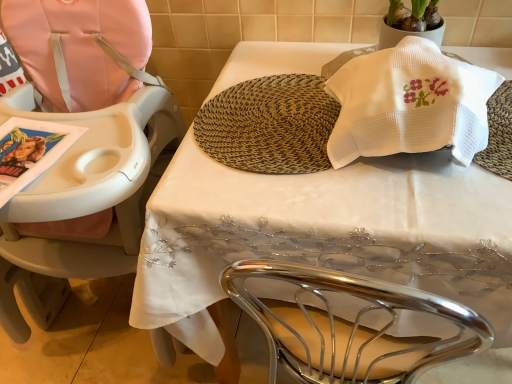
The width and height of the screenshot is (512, 384). Identify the location of white waffle-textured towel at upper right. (409, 104).

What do you see at coordinates (323, 234) in the screenshot?
I see `white embroidered tablecloth at center` at bounding box center [323, 234].

This screenshot has height=384, width=512. What do you see at coordinates (269, 125) in the screenshot? I see `brown woven mat at center` at bounding box center [269, 125].

Find the location of `white waffle-textured towel at upper right`. white waffle-textured towel at upper right is located at coordinates 409,104.

Is white waffle-textured towel at upper right smaller than brown woven mat at center?

No.

From the image's perspective, is white waffle-textured towel at upper right positioned above or below brown woven mat at center?

white waffle-textured towel at upper right is above brown woven mat at center.

Is white waffle-textured towel at upper right far away from brown woven mat at center?

Actually, white waffle-textured towel at upper right and brown woven mat at center are a little close together.

Does point (486, 143) come farther from viewer compared to point (224, 155)?

No, (486, 143) is closer to viewer.

In order to click on table located underneath the pink fabric highchair at left (from a real-world perspective) in this screenshot , I will do `click(323, 234)`.

Is pink fabric highchair at left not inside white embroidered tablecloth at center?

Absolutely, pink fabric highchair at left is external to white embroidered tablecloth at center.

Is pink fabric highchair at left far away from white embroidered tablecloth at center?

No, pink fabric highchair at left is in close proximity to white embroidered tablecloth at center.

Which of these two, pink fabric highchair at left or white embroidered tablecloth at center, is smaller?

pink fabric highchair at left is smaller.

Is point (396, 241) closer to viewer compared to point (399, 122)?

That is True.

What's the angular difference between white embroidered tablecloth at center and white waffle-textured towel at upper right's facing directions?

0.92 degrees.

Considering the relative sizes of white embroidered tablecloth at center and white waffle-textured towel at upper right in the image provided, is white embroidered tablecloth at center thinner than white waffle-textured towel at upper right?

No, white embroidered tablecloth at center is not thinner than white waffle-textured towel at upper right.

Based on their positions, is white embroidered tablecloth at center located to the left or right of white waffle-textured towel at upper right?

In the image, white embroidered tablecloth at center appears on the right side of white waffle-textured towel at upper right.

How many degrees apart are the facing directions of brown woven mat at center and white waffle-textured towel at upper right?

0.184 degrees separate the facing orientations of brown woven mat at center and white waffle-textured towel at upper right.

Locate an element on the screen. Image resolution: width=512 pixels, height=384 pixels. mat below the white waffle-textured towel at upper right (from the image's perspective) is located at coordinates (269, 125).

From a real-world perspective, who is located higher, brown woven mat at center or white waffle-textured towel at upper right?

white waffle-textured towel at upper right, from a real-world perspective.

Is brown woven mat at center oriented towards white waffle-textured towel at upper right?

No, brown woven mat at center is not turned towards white waffle-textured towel at upper right.

The width and height of the screenshot is (512, 384). Find the location of `chair to the left of brown woven mat at center`. chair to the left of brown woven mat at center is located at coordinates (83, 148).

Considering the sizes of objects brown woven mat at center and pink fabric highchair at left in the image provided, who is bigger, brown woven mat at center or pink fabric highchair at left?

pink fabric highchair at left.

How far apart are brown woven mat at center and pink fabric highchair at left?

13.14 inches.

Between brown woven mat at center and pink fabric highchair at left, which one has larger width?

pink fabric highchair at left is wider.

Who is shorter, brown woven mat at center or white embroidered tablecloth at center?

brown woven mat at center.

Does brown woven mat at center touch white embroidered tablecloth at center?

No, brown woven mat at center is not with white embroidered tablecloth at center.

Image resolution: width=512 pixels, height=384 pixels. In order to click on table below the brown woven mat at center (from a real-world perspective) in this screenshot , I will do [323, 234].

How much distance is there between white waffle-textured towel at upper right and white embroidered tablecloth at center?

They are 7.30 inches apart.

Which of these two, white waffle-textured towel at upper right or white embroidered tablecloth at center, is smaller?

Smaller between the two is white waffle-textured towel at upper right.

Looking at this image, is white waffle-textured towel at upper right next to white embroidered tablecloth at center and touching it?

No, white waffle-textured towel at upper right is not making contact with white embroidered tablecloth at center.

At what (x,y) coordinates should I click in order to perform the action: click on mat directly beneath the white waffle-textured towel at upper right (from a real-world perspective). Please return your answer as a coordinate pair (x, y). This screenshot has height=384, width=512. Looking at the image, I should click on (269, 125).

The height and width of the screenshot is (384, 512). I want to click on table below the pink fabric highchair at left (from the image's perspective), so click(x=323, y=234).

Estimate the real-world distances between objects in this image. Which object is closer to pink fabric highchair at left, white waffle-textured towel at upper right or white embroidered tablecloth at center?

Based on the image, white embroidered tablecloth at center appears to be nearer to pink fabric highchair at left.

Which object lies further to the anchor point white embroidered tablecloth at center, pink fabric highchair at left or brown woven mat at center?

pink fabric highchair at left.

From the image, which object appears to be farther from brown woven mat at center, white embroidered tablecloth at center or white waffle-textured towel at upper right?

The object further to brown woven mat at center is white waffle-textured towel at upper right.

From the image, which object appears to be farther from white waffle-textured towel at upper right, white embroidered tablecloth at center or pink fabric highchair at left?

pink fabric highchair at left is positioned further to the anchor white waffle-textured towel at upper right.

Considering their positions, is brown woven mat at center positioned further to white embroidered tablecloth at center than pink fabric highchair at left?

Based on the image, pink fabric highchair at left appears to be further to white embroidered tablecloth at center.

In the scene shown: Estimate the real-world distances between objects in this image. Which object is further from white waffle-textured towel at upper right, pink fabric highchair at left or white embroidered tablecloth at center?

Based on the image, pink fabric highchair at left appears to be further to white waffle-textured towel at upper right.

Consider the image. Considering their positions, is brown woven mat at center positioned closer to white waffle-textured towel at upper right than white embroidered tablecloth at center?

brown woven mat at center.

Considering their positions, is pink fabric highchair at left positioned closer to brown woven mat at center than white waffle-textured towel at upper right?

Based on the image, white waffle-textured towel at upper right appears to be nearer to brown woven mat at center.

You are a GUI agent. You are given a task and a screenshot of the screen. Output one action in this format:
    pyautogui.click(x=<x>, y=<y>)
    Task: Click on the mat between white waffle-textured towel at upper right and white embroidered tablecloth at center in the vertical direction
    This screenshot has height=384, width=512.
    Given the screenshot: What is the action you would take?
    pyautogui.click(x=269, y=125)

Locate an element on the screen. The height and width of the screenshot is (384, 512). mat between pink fabric highchair at left and white embroidered tablecloth at center is located at coordinates (269, 125).

This screenshot has width=512, height=384. What are the coordinates of `blanket between pink fabric highchair at left and white embroidered tablecloth at center in the horizontal direction` in the screenshot? It's located at (409, 104).

At what (x,y) coordinates should I click in order to perform the action: click on mat between pink fabric highchair at left and white waffle-textured towel at upper right from left to right. Please return your answer as a coordinate pair (x, y). Looking at the image, I should click on (269, 125).